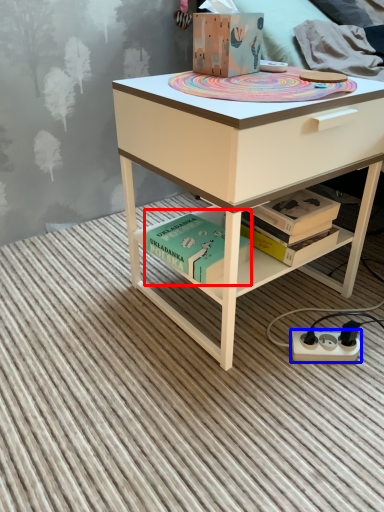
Question: Which point is further to the camera, book (highlighted by a red box) or power plugs and sockets (highlighted by a blue box)?

Choices:
 (A) book
 (B) power plugs and sockets

Answer: (B)